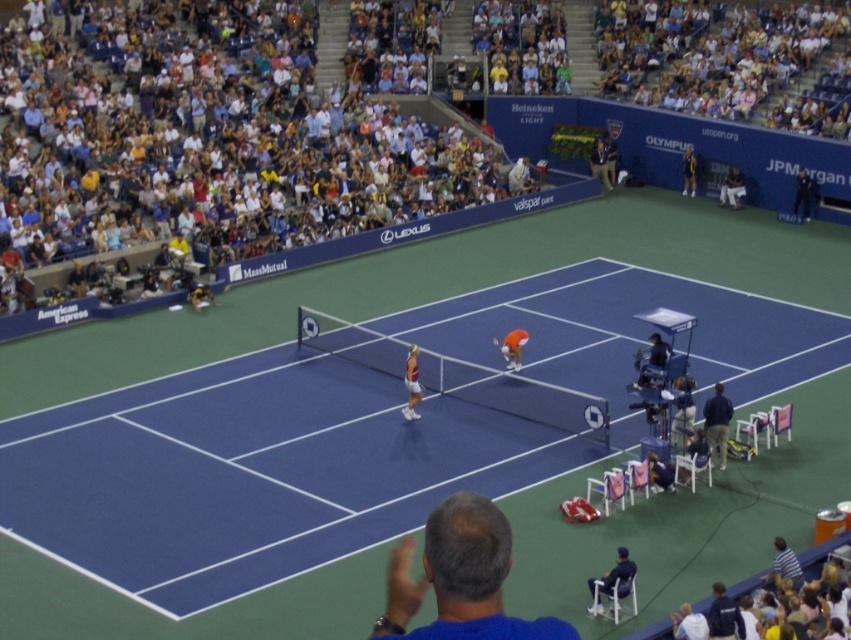
Question: Does white cotton crowd at upper left come behind orange fabric tennis outfit at center?

Choices:
 (A) yes
 (B) no

Answer: (B)

Question: From the image, what is the correct spatial relationship of blue fabric chair at lower right in relation to dark blue fabric chair at lower right?

Choices:
 (A) left
 (B) right

Answer: (A)

Question: Based on their relative distances, which object is farther from the dark blue fabric chair at lower right?

Choices:
 (A) orange fabric tennis racket at center
 (B) yellow fabric tennis racket at center

Answer: (B)

Question: Which object is closer to the camera taking this photo?

Choices:
 (A) dark blue fabric chair at lower right
 (B) white cotton crowd at upper left
 (C) yellow fabric tennis racket at center

Answer: (A)

Question: Is blue synthetic surface at center to the left of orange fabric tennis racket at center from the viewer's perspective?

Choices:
 (A) no
 (B) yes

Answer: (A)

Question: Which object is the closest to the dark blue shirt at upper right?

Choices:
 (A) dark blue fabric chair at lower right
 (B) orange fabric tennis outfit at center
 (C) blue synthetic surface at center

Answer: (B)